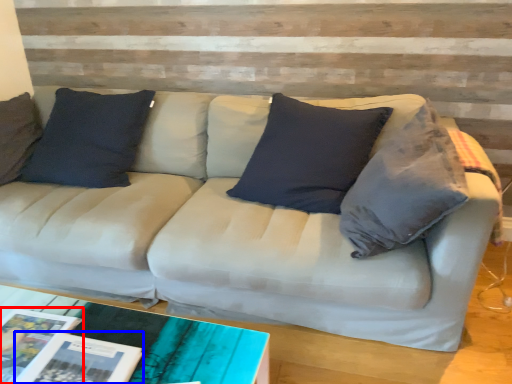
Question: Which object appears farthest to the camera in this image, magazine (highlighted by a red box) or magazine (highlighted by a blue box)?

Choices:
 (A) magazine
 (B) magazine

Answer: (A)